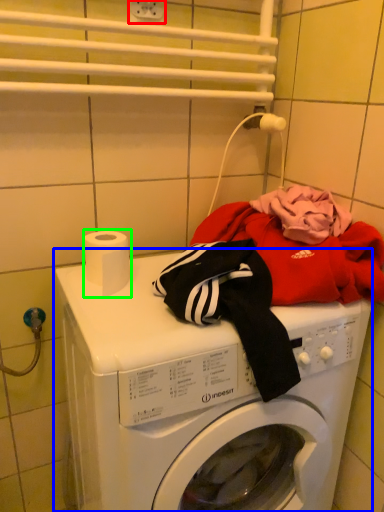
Question: Estimate the real-world distances between objects in this image. Which object is closer to electric outlet (highlighted by a red box), washing machine (highlighted by a blue box) or toilet paper (highlighted by a green box)?

Choices:
 (A) washing machine
 (B) toilet paper

Answer: (B)